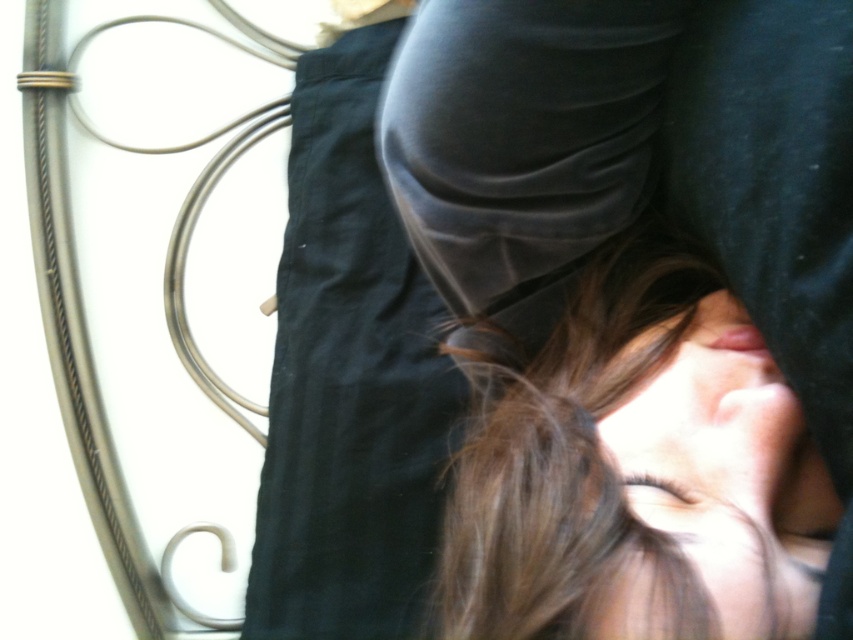
Question: Which point appears closest to the camera in this image?

Choices:
 (A) (450, 19)
 (B) (711, 586)

Answer: (B)

Question: Does smooth black fabric at center have a greater width compared to brown matte hair at center?

Choices:
 (A) no
 (B) yes

Answer: (B)

Question: Based on their relative distances, which object is farther from the smooth black fabric at center?

Choices:
 (A) matte black face at center
 (B) brown matte hair at center

Answer: (B)

Question: Can you confirm if smooth black fabric at center is positioned below matte black face at center?

Choices:
 (A) yes
 (B) no

Answer: (B)

Question: Is smooth black fabric at center below matte black face at center?

Choices:
 (A) yes
 (B) no

Answer: (B)

Question: Which point appears farthest from the camera in this image?

Choices:
 (A) (566, 538)
 (B) (642, 428)

Answer: (B)